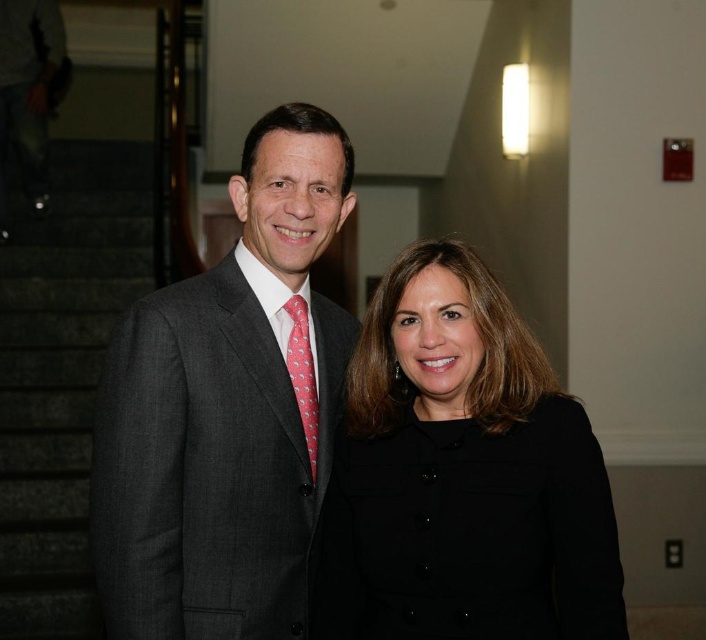
Is matte gray suit at center positioned in front of black matte coat at center?

That is True.

Can you confirm if matte gray suit at center is shorter than black matte coat at center?

In fact, matte gray suit at center may be taller than black matte coat at center.

Does point (289, 616) come closer to viewer compared to point (496, 580)?

No, (289, 616) is further to viewer.

Locate an element on the screen. The width and height of the screenshot is (706, 640). matte gray suit at center is located at coordinates (227, 410).

Is point (173, 285) positioned in front of point (301, 308)?

Yes, it is in front of point (301, 308).

Is matte gray suit at center above pink silk tie at center?

Indeed, matte gray suit at center is positioned over pink silk tie at center.

Is point (203, 588) in front of point (305, 342)?

Yes, it is.

Where is `matte gray suit at center`? This screenshot has width=706, height=640. matte gray suit at center is located at coordinates (227, 410).

Based on the photo, can you confirm if black matte coat at center is bigger than pink silk tie at center?

Correct, black matte coat at center is larger in size than pink silk tie at center.

Does black matte coat at center have a greater width compared to pink silk tie at center?

Indeed, black matte coat at center has a greater width compared to pink silk tie at center.

At what (x,y) coordinates should I click in order to perform the action: click on black matte coat at center. Please return your answer as a coordinate pair (x, y). The image size is (706, 640). Looking at the image, I should click on (460, 476).